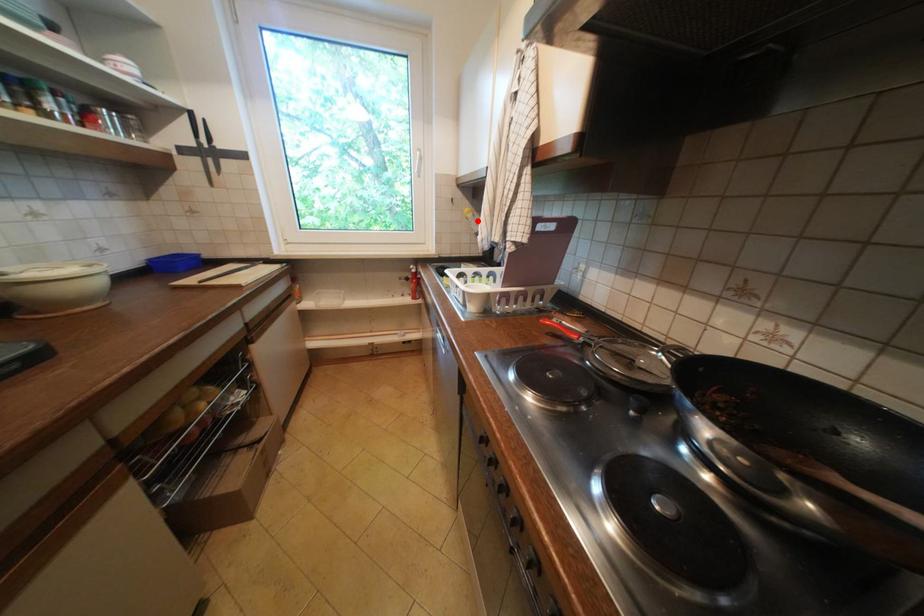
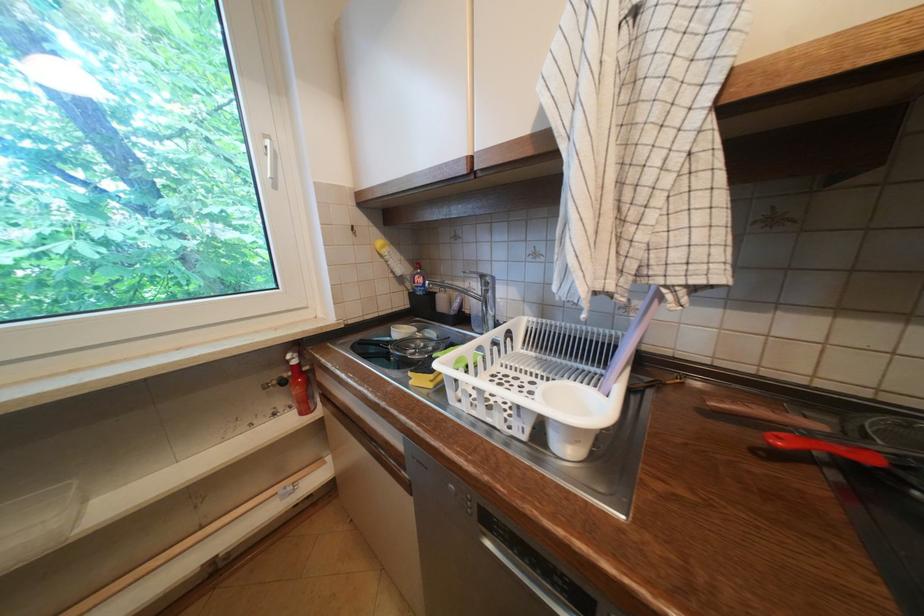
Find the pixel in the second image that matches the highlighted location in the first image.

(394, 259)